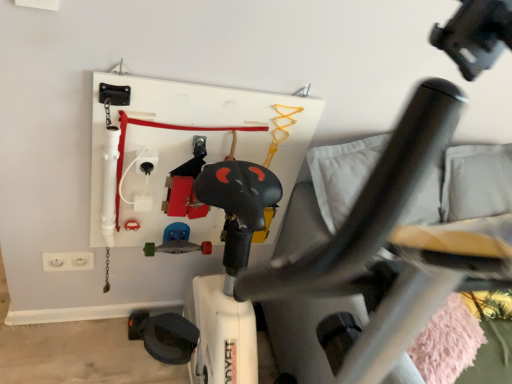
Question: From the image's perspective, is black plastic swivel chair at center on white plastic electrical outlet at lower left?

Choices:
 (A) yes
 (B) no

Answer: (A)

Question: Considering the relative sizes of black plastic swivel chair at center and white plastic electrical outlet at lower left in the image provided, is black plastic swivel chair at center thinner than white plastic electrical outlet at lower left?

Choices:
 (A) yes
 (B) no

Answer: (B)

Question: Is black plastic swivel chair at center with white plastic electrical outlet at lower left?

Choices:
 (A) no
 (B) yes

Answer: (A)

Question: Is black plastic swivel chair at center outside of white plastic electrical outlet at lower left?

Choices:
 (A) yes
 (B) no

Answer: (A)

Question: Is black plastic swivel chair at center facing away from white plastic electrical outlet at lower left?

Choices:
 (A) no
 (B) yes

Answer: (A)

Question: Considering the relative sizes of black plastic swivel chair at center and white plastic electrical outlet at lower left in the image provided, is black plastic swivel chair at center shorter than white plastic electrical outlet at lower left?

Choices:
 (A) no
 (B) yes

Answer: (A)

Question: Is metallic silver skateboard at center next to white plastic electrical outlet at lower left and touching it?

Choices:
 (A) no
 (B) yes

Answer: (A)

Question: Can you confirm if metallic silver skateboard at center is taller than white plastic electrical outlet at lower left?

Choices:
 (A) yes
 (B) no

Answer: (B)

Question: Is metallic silver skateboard at center looking in the opposite direction of white plastic electrical outlet at lower left?

Choices:
 (A) yes
 (B) no

Answer: (B)

Question: Can you confirm if metallic silver skateboard at center is positioned to the left of white plastic electrical outlet at lower left?

Choices:
 (A) yes
 (B) no

Answer: (B)

Question: Considering the relative positions of metallic silver skateboard at center and white plastic electrical outlet at lower left in the image provided, is metallic silver skateboard at center in front of white plastic electrical outlet at lower left?

Choices:
 (A) no
 (B) yes

Answer: (B)

Question: From the image's perspective, is metallic silver skateboard at center beneath white plastic electrical outlet at lower left?

Choices:
 (A) yes
 (B) no

Answer: (B)

Question: From a real-world perspective, is metallic silver skateboard at center over black plastic swivel chair at center?

Choices:
 (A) no
 (B) yes

Answer: (A)